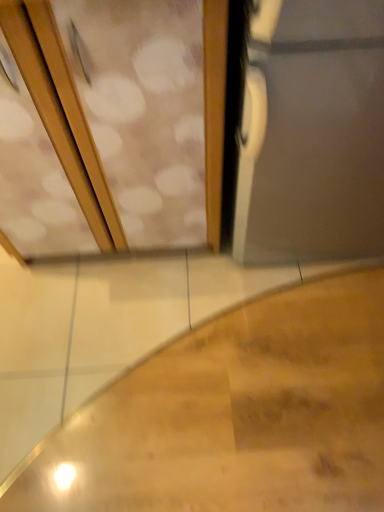
Identify the location of free point above wooden stairs at lower left (from a real-world perspective). The height and width of the screenshot is (512, 384). (188, 356).